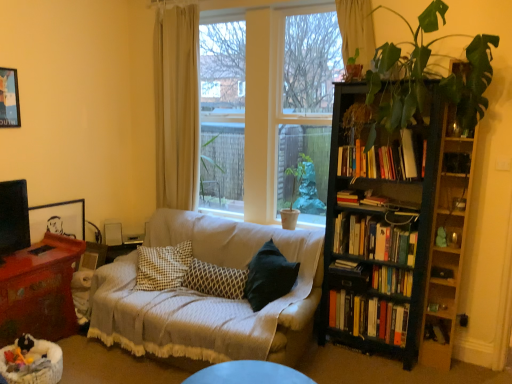
Question: Can you confirm if hardcover book at center, the second book positioned from the top, is wider than patterned fabric pillow at center?

Choices:
 (A) no
 (B) yes

Answer: (B)

Question: Is the depth of hardcover book at center, which is the 5th book from bottom to top, greater than that of patterned fabric pillow at center?

Choices:
 (A) no
 (B) yes

Answer: (A)

Question: Does hardcover book at center, which is the 5th book from bottom to top, have a lesser height compared to patterned fabric pillow at center?

Choices:
 (A) yes
 (B) no

Answer: (A)

Question: Does hardcover book at center, which is the 5th book from bottom to top, have a smaller size compared to patterned fabric pillow at center?

Choices:
 (A) yes
 (B) no

Answer: (A)

Question: Is hardcover book at center, the second book positioned from the top, outside patterned fabric pillow at center?

Choices:
 (A) yes
 (B) no

Answer: (A)

Question: Looking at their shapes, would you say hardcover books at center-right, placed as the first book when sorted from top to bottom, is wider or thinner than hardcover books at right, arranged as the 4th book when ordered from the bottom?

Choices:
 (A) wide
 (B) thin

Answer: (A)

Question: Is point (401, 140) closer or farther from the camera than point (392, 231)?

Choices:
 (A) farther
 (B) closer

Answer: (B)

Question: Is hardcover books at center-right, placed as the first book when sorted from top to bottom, inside the boundaries of hardcover books at right, placed as the 3th book when sorted from top to bottom, or outside?

Choices:
 (A) outside
 (B) inside

Answer: (A)

Question: Considering the positions of hardcover books at center-right, placed as the 6th book when sorted from bottom to top, and hardcover books at right, placed as the 3th book when sorted from top to bottom, in the image, is hardcover books at center-right, placed as the 6th book when sorted from bottom to top, taller or shorter than hardcover books at right, placed as the 3th book when sorted from top to bottom,?

Choices:
 (A) tall
 (B) short

Answer: (A)

Question: From a real-world perspective, relative to hardcover books at right, which ranks as the 5th book in top-to-bottom order, is mahogany wood table at lower left vertically above or below?

Choices:
 (A) below
 (B) above

Answer: (A)

Question: Do you think mahogany wood table at lower left is within hardcover books at right, which ranks as the 5th book in top-to-bottom order, or outside of it?

Choices:
 (A) outside
 (B) inside

Answer: (A)

Question: From the image's perspective, is mahogany wood table at lower left above or below hardcover books at right, marked as the 2th book in a bottom-to-top arrangement?

Choices:
 (A) below
 (B) above

Answer: (A)

Question: Is mahogany wood table at lower left wider or thinner than hardcover books at right, which ranks as the 5th book in top-to-bottom order?

Choices:
 (A) thin
 (B) wide

Answer: (B)

Question: Is hardcover books at right, marked as the 2th book in a bottom-to-top arrangement, taller or shorter than brushed metal picture frame at upper left, the first picture frame when ordered from left to right?

Choices:
 (A) short
 (B) tall

Answer: (A)

Question: Is hardcover books at right, marked as the 2th book in a bottom-to-top arrangement, to the left or to the right of brushed metal picture frame at upper left, positioned as the second picture frame in right-to-left order, in the image?

Choices:
 (A) left
 (B) right

Answer: (B)